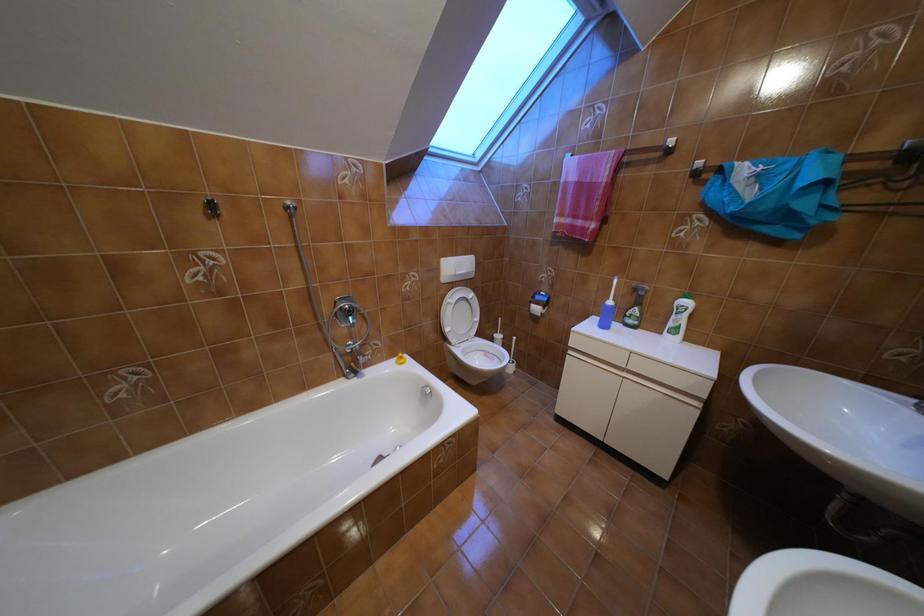
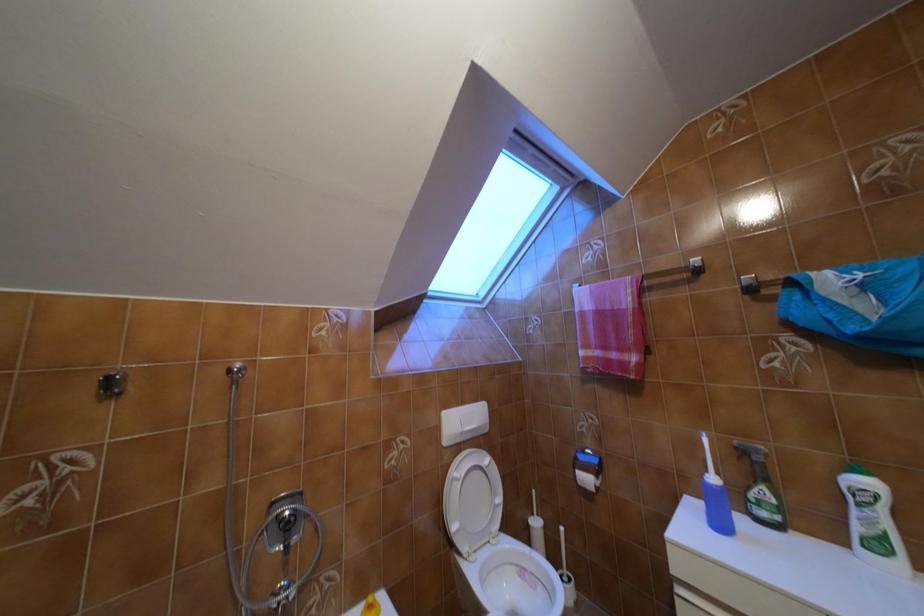
Question: In a continuous first-person perspective shot, in which direction is the camera moving?

Choices:
 (A) Left
 (B) Right
 (C) Forward
 (D) Backward

Answer: (C)